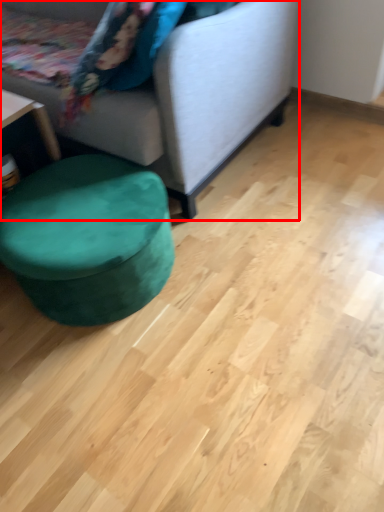
Question: From the image's perspective, where is studio couch (annotated by the red box) located relative to music stool?

Choices:
 (A) above
 (B) below

Answer: (A)